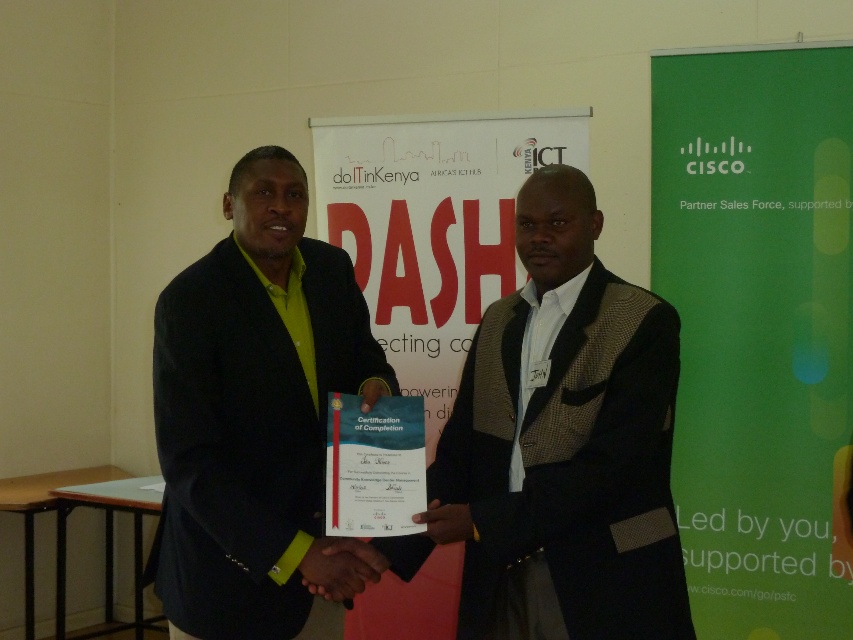
Based on the scene description, which object is positioned to the right when observing the dark brown textured blazer at center and the matte black suit at center?

The dark brown textured blazer at center is to the right of the matte black suit at center.

Based on the scene description, which object is smaller in size between the dark brown textured blazer at center and the matte black suit at center?

The dark brown textured blazer at center is smaller than the matte black suit at center according to the description.